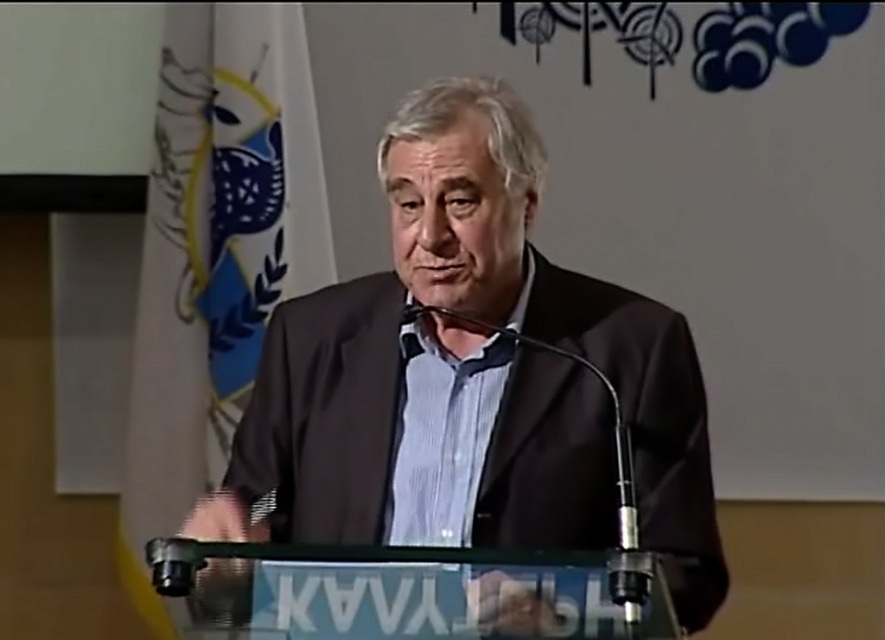
You are an event photographer trying to capture the speaker in the center. You notice the dark blue shirt at center and the white fabric flag at upper left. Which object would appear bigger in your photo?

The dark blue shirt at center appears bigger in the photo because it is larger in size than the white fabric flag at upper left.

You are a photographer setting up for a speech event. You need to ensure the dark blue shirt at center and the white fabric flag at upper left are both visible in your shot. Given their sizes, which object should you adjust your camera angle to focus on first to capture both?

The dark blue shirt at center is not as tall as the white fabric flag at upper left, so you should focus on the white fabric flag at upper left first to ensure it fits in the frame along with the shorter dark blue shirt at center.

You are a photographer trying to capture the speaker in the scene. You need to ensure that the dark blue shirt at center and the white fabric flag at upper left are both visible in the frame. Considering their sizes, which object should you adjust your camera angle to prioritize framing around to include both?

The dark blue shirt at center is wider than the white fabric flag at upper left, so you should prioritize framing around the wider dark blue shirt at center to ensure both objects fit in the frame.